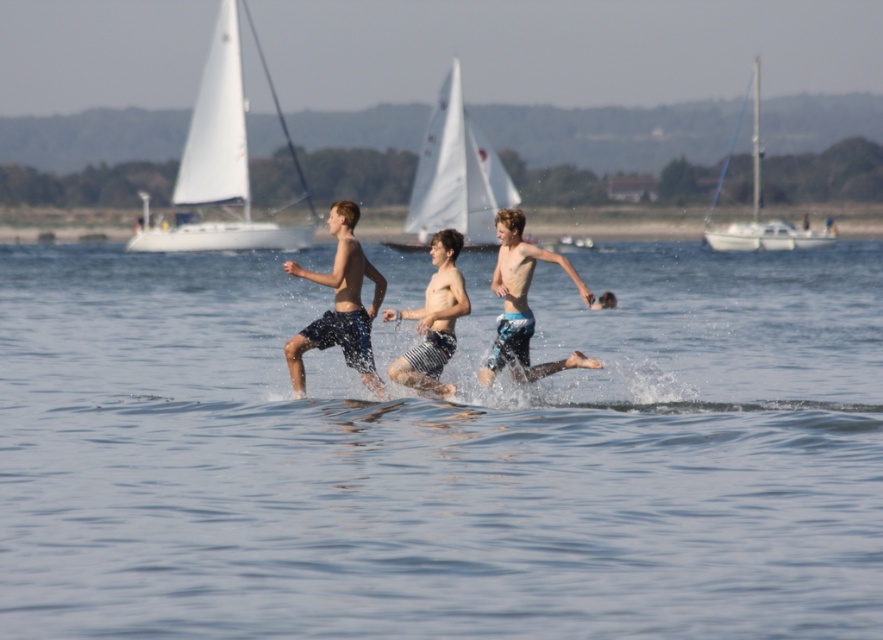
Is point (315, 337) closer to camera compared to point (447, 355)?

Yes, point (315, 337) is in front of point (447, 355).

Locate an element on the screen. The width and height of the screenshot is (883, 640). dark blue shorts at center is located at coordinates (340, 305).

Locate an element on the screen. The width and height of the screenshot is (883, 640). dark blue shorts at center is located at coordinates (340, 305).

Does point (185, 166) come in front of point (519, 285)?

That is False.

Describe the element at coordinates (217, 163) in the screenshot. I see `white sailboat at upper left` at that location.

Identify the location of white sailboat at upper left. (217, 163).

Can you confirm if blue patterned shorts at center is bigger than striped shorts at center?

Correct, blue patterned shorts at center is larger in size than striped shorts at center.

Between blue patterned shorts at center and striped shorts at center, which one is positioned higher?

Positioned higher is blue patterned shorts at center.

Does point (534, 257) come closer to viewer compared to point (405, 360)?

No, (534, 257) is further to viewer.

The height and width of the screenshot is (640, 883). What are the coordinates of `blue patterned shorts at center` in the screenshot? It's located at (522, 304).